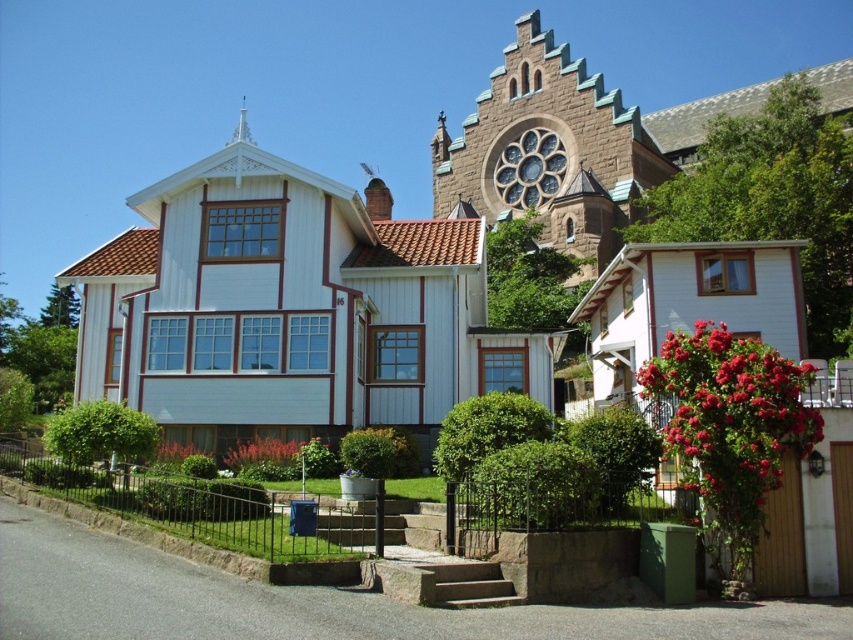
Question: Which point appears closest to the camera in this image?

Choices:
 (A) (563, 176)
 (B) (543, 356)

Answer: (B)

Question: Is white wood house at center positioned behind brown stone chapel at upper center?

Choices:
 (A) no
 (B) yes

Answer: (A)

Question: Can you confirm if white wood house at center is thinner than brown stone chapel at upper center?

Choices:
 (A) yes
 (B) no

Answer: (B)

Question: Which of the following is the closest to the observer?

Choices:
 (A) white wood house at center
 (B) brown stone chapel at upper center

Answer: (A)

Question: Is white wood house at center thinner than brown stone chapel at upper center?

Choices:
 (A) yes
 (B) no

Answer: (B)

Question: Which object is closer to the camera taking this photo?

Choices:
 (A) brown stone chapel at upper center
 (B) white wood house at center

Answer: (B)